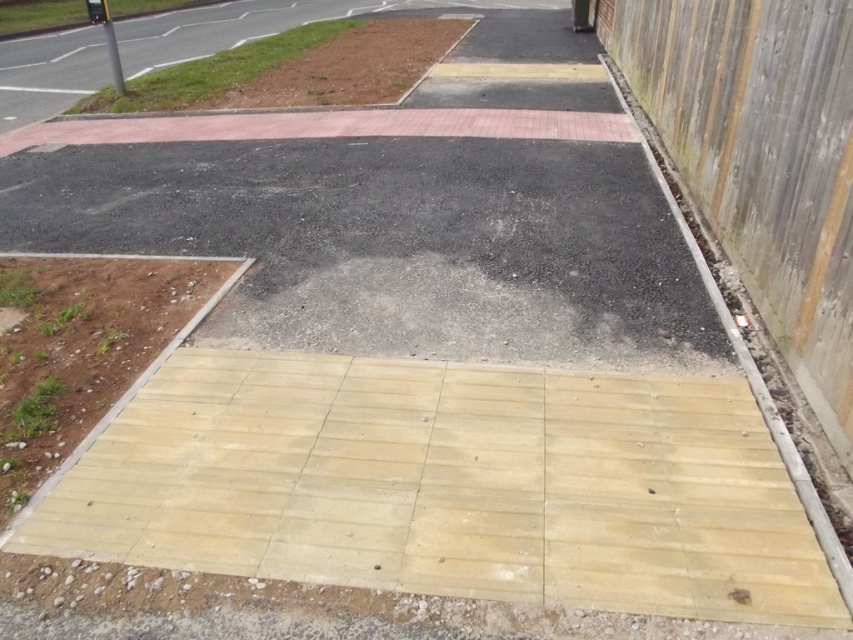
Between smooth yellow concrete at center and wooden at right, which one appears on the left side from the viewer's perspective?

From the viewer's perspective, smooth yellow concrete at center appears more on the left side.

Does smooth yellow concrete at center appear under wooden at right?

Yes, smooth yellow concrete at center is below wooden at right.

The height and width of the screenshot is (640, 853). Find the location of `smooth yellow concrete at center`. smooth yellow concrete at center is located at coordinates (450, 484).